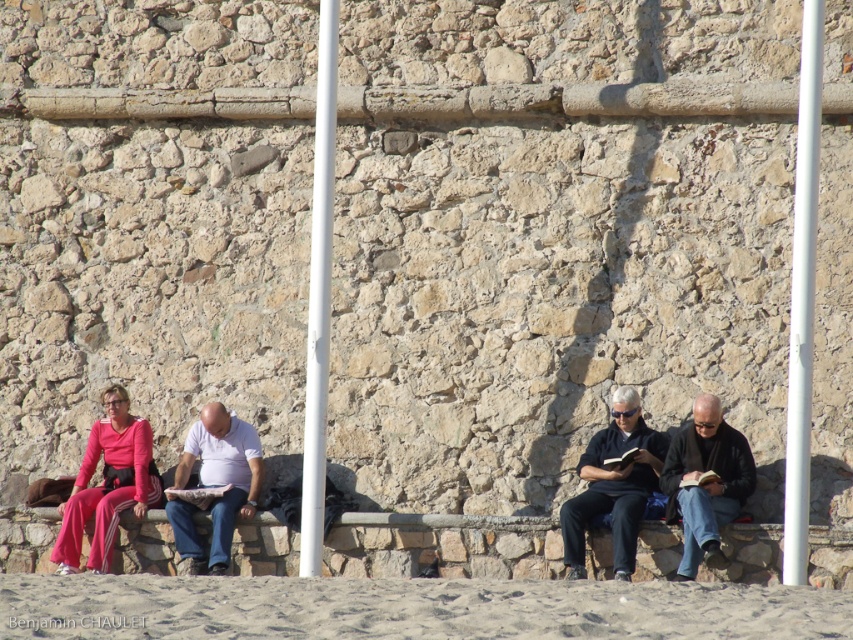
Question: Can you confirm if pink fabric pants at left is thinner than dark gray leather jacket at lower right?

Choices:
 (A) yes
 (B) no

Answer: (B)

Question: Which is farther from the white smooth pole at center?

Choices:
 (A) dark blue shirt at center
 (B) white smooth pole at right
 (C) fine-grained sand at lower center
 (D) matte black book at center

Answer: (B)

Question: Which point is farther from the camera taking this photo?

Choices:
 (A) 231,577
 (B) 332,148
 (C) 786,445
 (D) 178,492

Answer: (D)

Question: Does fine-grained sand at lower center have a larger size compared to dark gray leather jacket at lower right?

Choices:
 (A) yes
 (B) no

Answer: (A)

Question: Which point is farther to the camera?

Choices:
 (A) (187, 490)
 (B) (712, 401)
 (C) (308, 452)
 (D) (85, 465)

Answer: (D)

Question: In this image, where is dark gray leather jacket at lower right located relative to matte black book at center?

Choices:
 (A) right
 (B) left

Answer: (A)